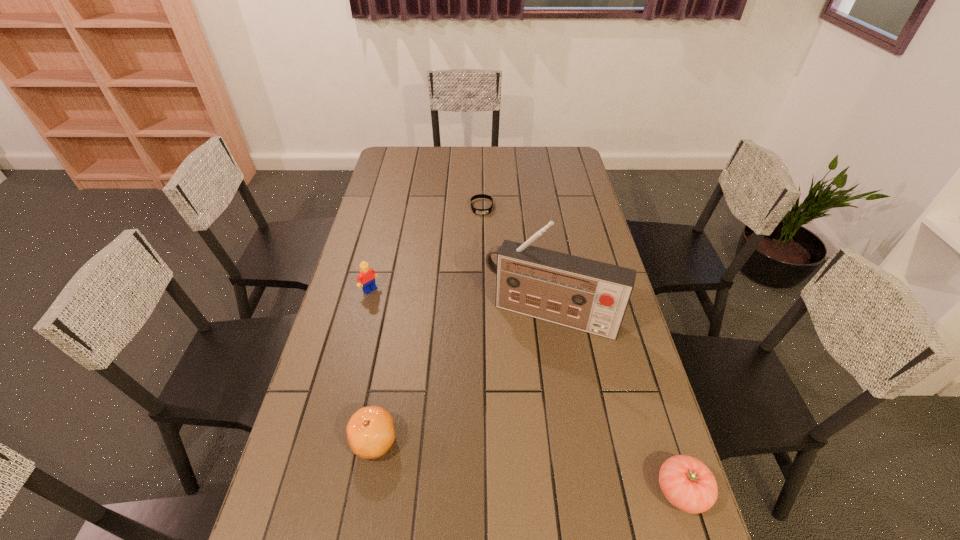
In order to click on empty space that is in between the clementine and the wristband in this screenshot , I will do `click(428, 324)`.

You are a GUI agent. You are given a task and a screenshot of the screen. Output one action in this format:
    pyautogui.click(x=<x>, y=<y>)
    Task: Click on the empty space that is in between the farthest object and the fourth shortest object
    
    Given the screenshot: What is the action you would take?
    (426, 248)

At what (x,y) coordinates should I click in order to perform the action: click on free area in between the second tallest object and the tomato. Please return your answer as a coordinate pair (x, y). Looking at the image, I should click on (526, 390).

This screenshot has width=960, height=540. Find the location of `free spot between the fourth shortest object and the second object from left to right`. free spot between the fourth shortest object and the second object from left to right is located at coordinates (372, 365).

You are a GUI agent. You are given a task and a screenshot of the screen. Output one action in this format:
    pyautogui.click(x=<x>, y=<y>)
    Task: Click on the vacant space in between the tallest object and the second tallest object
    The image size is (960, 540).
    Given the screenshot: What is the action you would take?
    pyautogui.click(x=461, y=302)

Locate an element on the screen. The image size is (960, 540). free area in between the tomato and the radio receiver is located at coordinates (616, 403).

The height and width of the screenshot is (540, 960). Identify the location of object that is the second closest to the farthest object. (366, 279).

The image size is (960, 540). I want to click on object that stands as the second closest to the second tallest object, so click(x=370, y=432).

This screenshot has height=540, width=960. Find the location of `vacant space that satisfies the following two spatial constraints: 1. on the front side of the Lego; 2. on the right side of the clementine`. vacant space that satisfies the following two spatial constraints: 1. on the front side of the Lego; 2. on the right side of the clementine is located at coordinates (332, 441).

Image resolution: width=960 pixels, height=540 pixels. Identify the location of free space that satisfies the following two spatial constraints: 1. on the back side of the shortest object; 2. on the right side of the leftmost object. (391, 207).